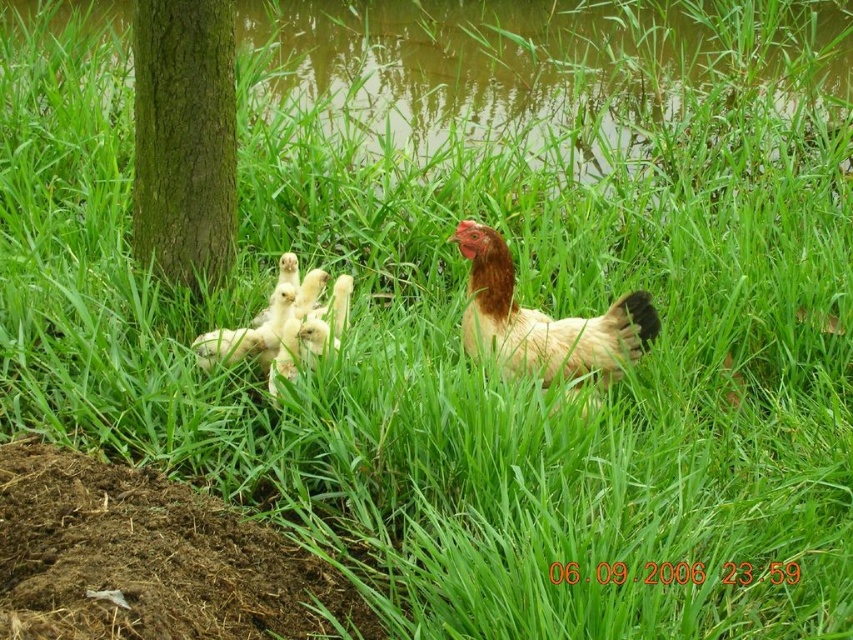
What are the coordinates of the brown feathered chicken at center in the image?

The brown feathered chicken at center is located at coordinates point (544, 321).

In the scene shown: You are a small bird trying to fly from the green rough bark tree at left to the brown feathered chicken at center. Which direction should you fly to reach the chicken?

The green rough bark tree at left is to the left of the brown feathered chicken at center, so you should fly to the right to reach the chicken.

Based on the photo, you are a drone operator trying to capture a closeup of the green rough bark tree at left. The drone is currently at the center of the image. Which direction should you move the drone to get closer to the tree?

The green rough bark tree at left is located at point (183, 138), which means it is in the lower left quadrant of the image. Since the drone is at the center, you should move it towards the lower left direction to get closer to the tree.